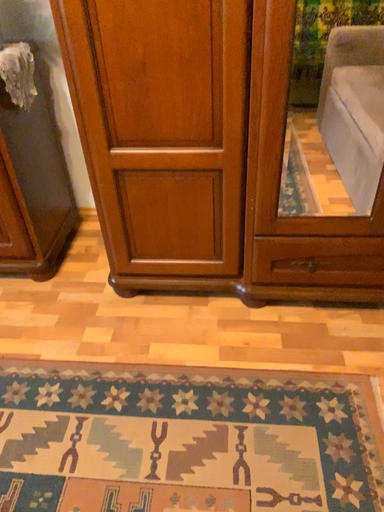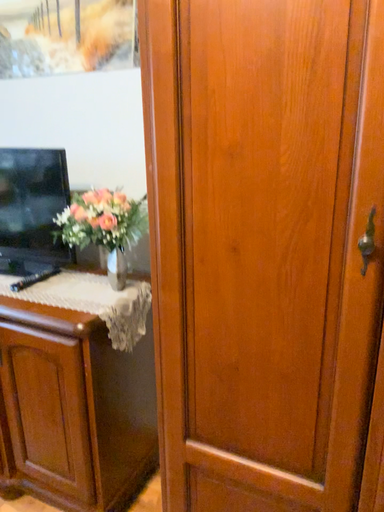
Question: How did the camera likely rotate when shooting the video?

Choices:
 (A) rotated right
 (B) rotated left

Answer: (B)